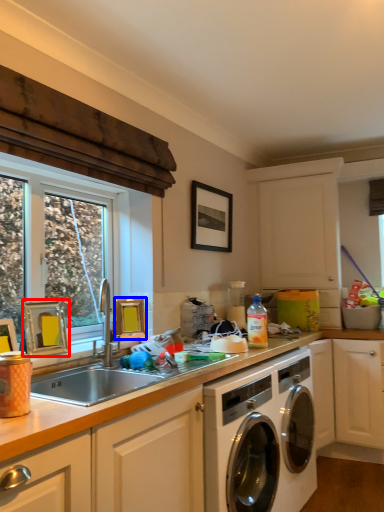
Question: Which of the following is the closest to the observer, picture frame (highlighted by a red box) or picture frame (highlighted by a blue box)?

Choices:
 (A) picture frame
 (B) picture frame

Answer: (A)